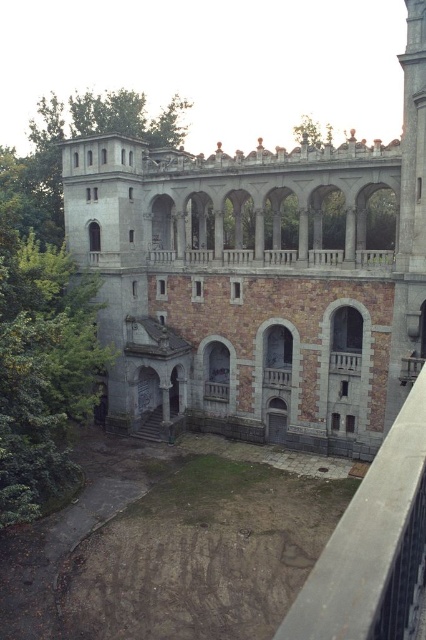
Who is taller, gray concrete rail at center or stone textured balcony at center?

Standing taller between the two is gray concrete rail at center.

Is gray concrete rail at center positioned in front of stone textured balcony at center?

Yes, gray concrete rail at center is closer to the viewer.

Does point (351, 566) come closer to viewer compared to point (336, 355)?

Yes, point (351, 566) is in front of point (336, 355).

The width and height of the screenshot is (426, 640). I want to click on gray concrete rail at center, so click(374, 545).

Between stone gray palace at center and gray concrete rail at center, which one has less height?

With less height is gray concrete rail at center.

Is point (124, 170) less distant than point (386, 632)?

No, (124, 170) is further to viewer.

Find the location of `stone gray palace at center`. stone gray palace at center is located at coordinates 259,278.

Which is more to the right, stone gray palace at center or smooth stone balcony at center?

From the viewer's perspective, stone gray palace at center appears more on the right side.

From the picture: Which is below, stone gray palace at center or smooth stone balcony at center?

Positioned lower is smooth stone balcony at center.

Describe the element at coordinates (259, 278) in the screenshot. I see `stone gray palace at center` at that location.

Image resolution: width=426 pixels, height=640 pixels. I want to click on stone gray palace at center, so click(x=259, y=278).